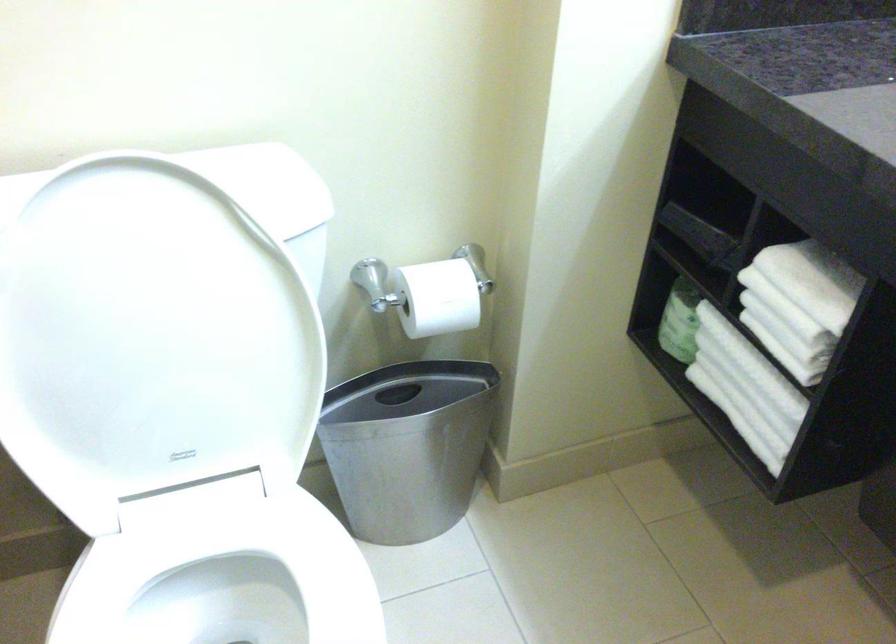
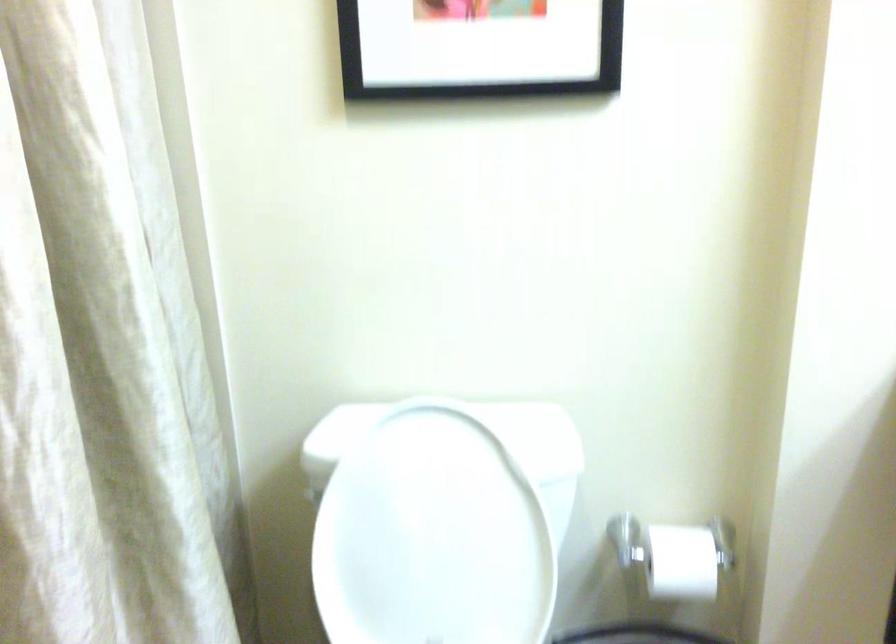
The point at (446, 297) is marked in the first image. Where is the corresponding point in the second image?

(682, 562)